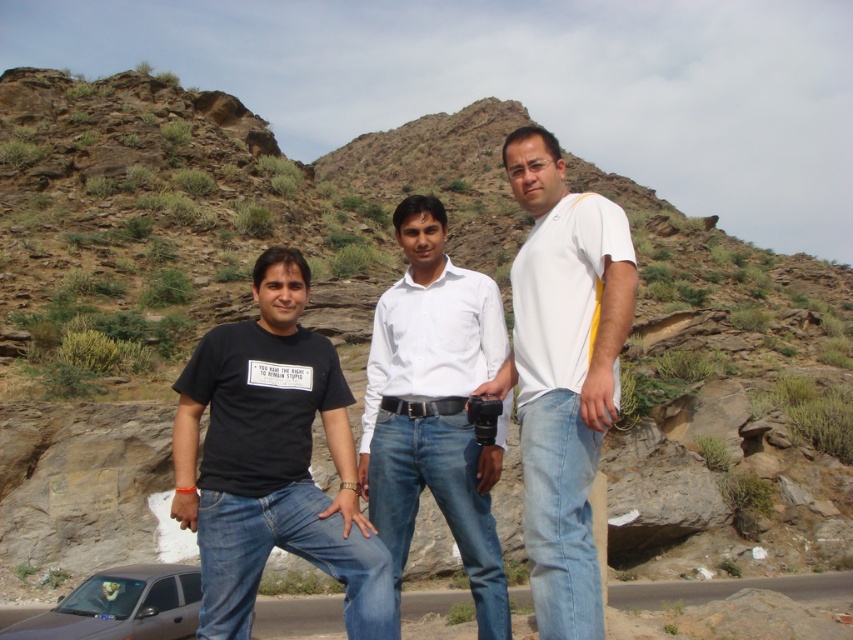
You are a photographer standing in the mountainous area and you see the brushed metal car at lower left and the black leather belt at center. Which object is located to the right of the other?

The brushed metal car at lower left is positioned on the right side of black leather belt at center, so the brushed metal car at lower left is to the right of the black leather belt at center.

You are standing in the mountainous area shown in the image. There is a point marked at coordinates (728,588). What object is located at this point?

The point at coordinates (728,588) marks the location of the brushed metal car at lower left.

You are standing at the center of the scene and want to take a photo of both the metallic silver car at lower left and the brushed metal car at lower left. Which car should you move towards to include both in your frame without moving the cars?

You should move towards the brushed metal car at lower left because the metallic silver car at lower left is already positioned to the left of it, allowing both to be captured in the frame when closer to the rightmost car.